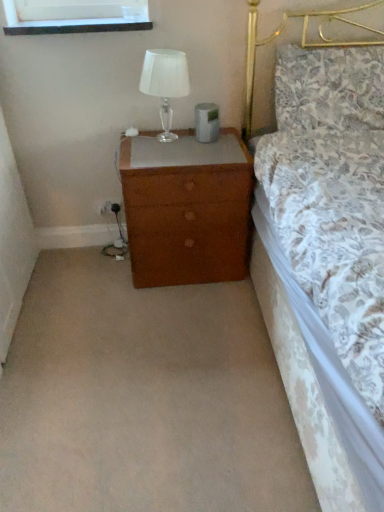
Where is `free point to the left of brown wood chest of drawers at center`? This screenshot has width=384, height=512. free point to the left of brown wood chest of drawers at center is located at coordinates (87, 274).